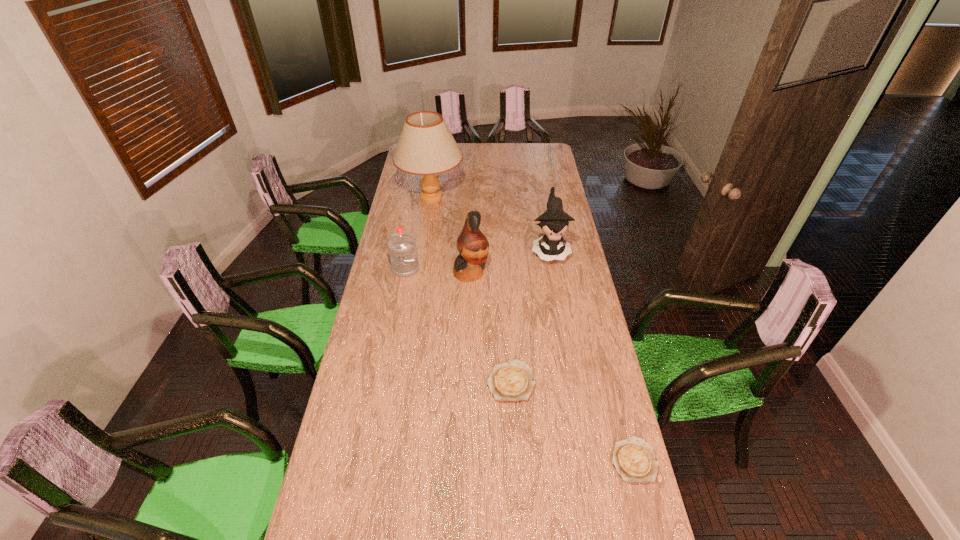
Image resolution: width=960 pixels, height=540 pixels. I want to click on unoccupied area between the left quiche and the third shortest object, so tap(458, 325).

Locate an element on the screen. The height and width of the screenshot is (540, 960). unoccupied position between the taller quiche and the lampshade is located at coordinates (471, 290).

Identify the location of vacant area that lies between the water bottle and the second shortest object. This screenshot has width=960, height=540. (458, 325).

This screenshot has height=540, width=960. I want to click on vacant space that's between the lampshade and the parrot, so click(x=451, y=235).

At what (x,y) coordinates should I click in order to perform the action: click on free space between the doll and the second tallest object. Please return your answer as a coordinate pair (x, y). The width and height of the screenshot is (960, 540). Looking at the image, I should click on (511, 261).

Locate which object is the fourth closest to the water bottle. Please provide its 2D coordinates. Your answer should be formatted as a tuple, i.e. [(x, y)], where the tuple contains the x and y coordinates of a point satisfying the conditions above.

[(512, 381)]

Point out which object is positioned as the second nearest to the nearer quiche. Please provide its 2D coordinates. Your answer should be formatted as a tuple, i.e. [(x, y)], where the tuple contains the x and y coordinates of a point satisfying the conditions above.

[(473, 246)]

Identify the location of vacant space that satisfies the following two spatial constraints: 1. on the face of the parrot; 2. on the right side of the right quiche. (467, 460).

The image size is (960, 540). Identify the location of free location that satisfies the following two spatial constraints: 1. on the face of the parrot; 2. on the left side of the left quiche. (468, 381).